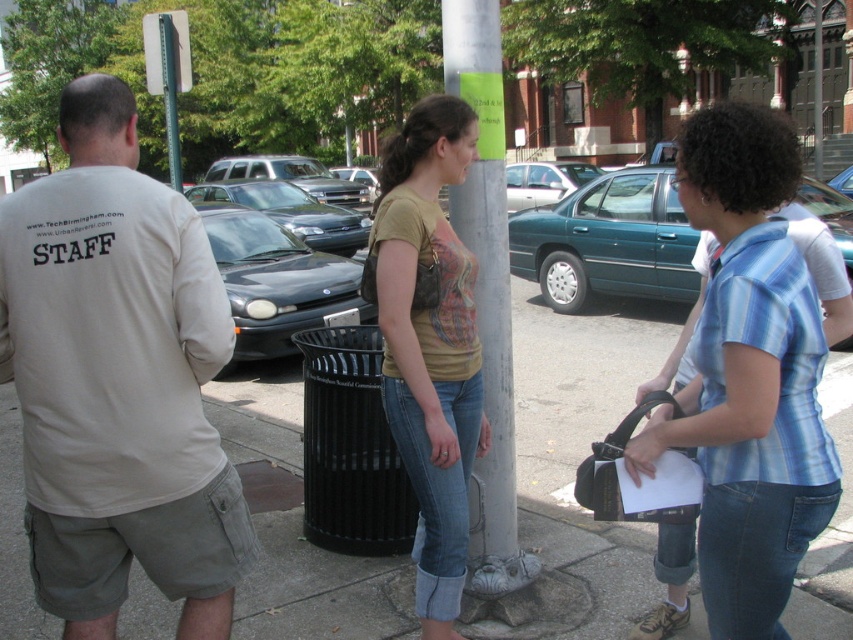
Does gray metallic pole at center appear on the left side of silver metallic suv at center?

No, gray metallic pole at center is not to the left of silver metallic suv at center.

Does point (486, 484) come in front of point (355, 196)?

Yes, point (486, 484) is closer to viewer.

Locate an element on the screen. This screenshot has height=640, width=853. gray metallic pole at center is located at coordinates (486, 269).

Who is shorter, smooth concrete sidewalk at center or teal matte sedan at center?

With less height is smooth concrete sidewalk at center.

Looking at this image, does smooth concrete sidewalk at center have a greater width compared to teal matte sedan at center?

No, smooth concrete sidewalk at center is not wider than teal matte sedan at center.

Does point (16, 557) come farther from viewer compared to point (534, 211)?

No, it is not.

Where is `smooth concrete sidewalk at center`? This screenshot has width=853, height=640. smooth concrete sidewalk at center is located at coordinates (318, 588).

Does beige cotton shirt at center have a greater height compared to gray metallic pole at center?

No, beige cotton shirt at center is not taller than gray metallic pole at center.

Where is `beige cotton shirt at center`? The width and height of the screenshot is (853, 640). beige cotton shirt at center is located at coordinates (117, 380).

The height and width of the screenshot is (640, 853). Find the location of `beige cotton shirt at center`. beige cotton shirt at center is located at coordinates (117, 380).

Find the location of a particular element. beige cotton shirt at center is located at coordinates (117, 380).